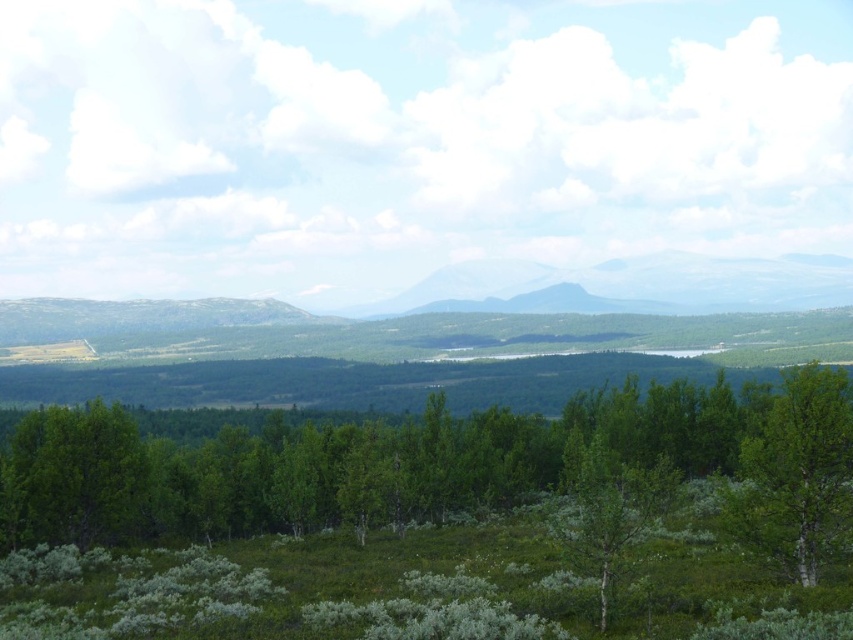
Does green leafy trees at center have a smaller size compared to green leafy tree at right?

Actually, green leafy trees at center might be larger than green leafy tree at right.

Between point (538, 428) and point (802, 426), which one is positioned in front?

Point (802, 426)

Image resolution: width=853 pixels, height=640 pixels. What do you see at coordinates (436, 464) in the screenshot?
I see `green leafy trees at center` at bounding box center [436, 464].

Locate an element on the screen. This screenshot has height=640, width=853. green leafy trees at center is located at coordinates (436, 464).

Can you confirm if green leafy tree at lower left is positioned below green matte tree at center?

Correct, green leafy tree at lower left is located below green matte tree at center.

Based on the photo, measure the distance between green leafy tree at lower left and green matte tree at center.

The distance of green leafy tree at lower left from green matte tree at center is 31.38 meters.

I want to click on green leafy tree at lower left, so click(73, 476).

Is point (152, 508) closer to camera compared to point (132, 458)?

No, it is behind (132, 458).

Is green leafy trees at center closer to the viewer compared to green leafy tree at lower left?

Yes, green leafy trees at center is in front of green leafy tree at lower left.

Is point (772, 419) positioned in front of point (134, 486)?

Yes, point (772, 419) is closer to viewer.

This screenshot has height=640, width=853. Find the location of `green leafy trees at center`. green leafy trees at center is located at coordinates (436, 464).